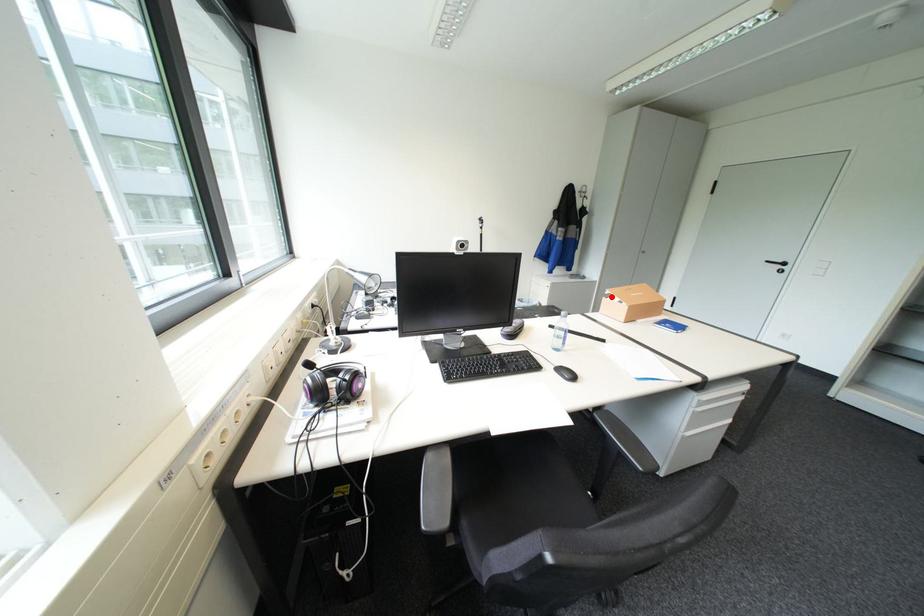
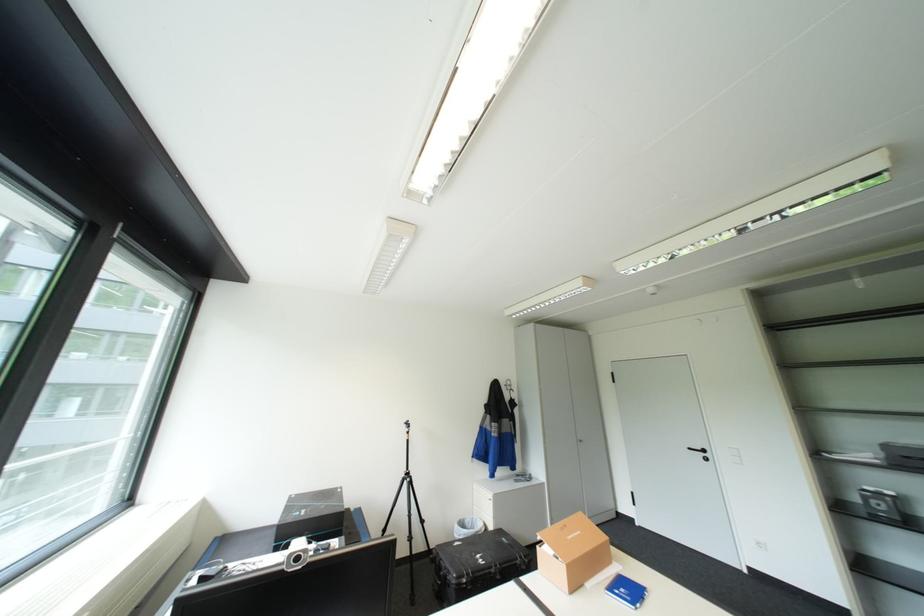
In the second image, find the point that corresponds to the highlighted location in the first image.

(545, 545)